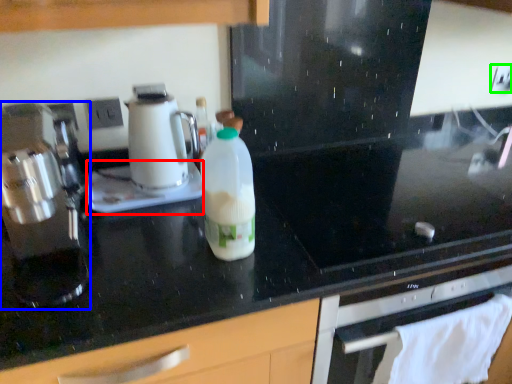
Question: Which object is the farthest from appliance (highlighted by a red box)? Choose among these: kitchen appliance (highlighted by a blue box) or electric outlet (highlighted by a green box).

Choices:
 (A) kitchen appliance
 (B) electric outlet

Answer: (B)